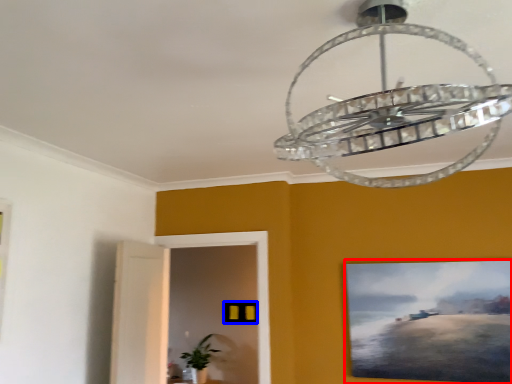
Question: Which of the following is the closest to the observer, picture frame (highlighted by a red box) or picture frame (highlighted by a blue box)?

Choices:
 (A) picture frame
 (B) picture frame

Answer: (A)